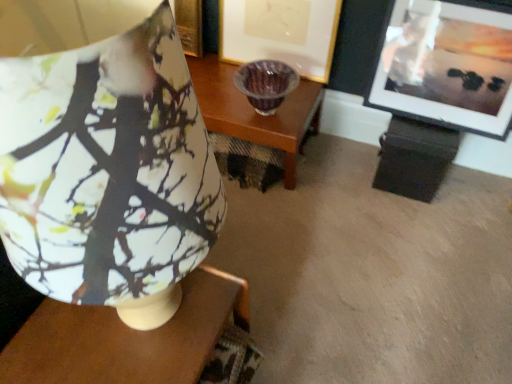
Where is `free space above matte wood table at center (from a real-world perspective)`? free space above matte wood table at center (from a real-world perspective) is located at coordinates pos(118,336).